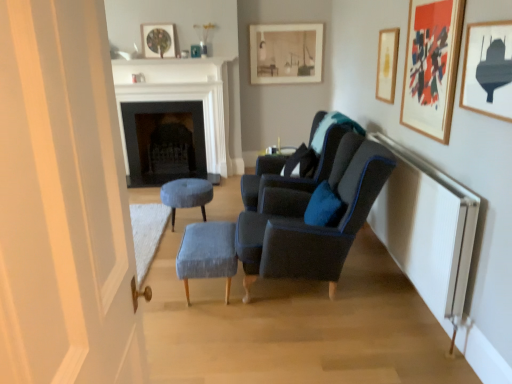
Question: Is dark gray stone fireplace at center, the 2th fireplace from the front, closer to the viewer compared to velvet grey stool at center, arranged as the second stool when viewed from the front?

Choices:
 (A) no
 (B) yes

Answer: (A)

Question: From a real-world perspective, is dark gray stone fireplace at center, the 2th fireplace from the front, physically above velvet grey stool at center, arranged as the first stool when viewed from the back?

Choices:
 (A) no
 (B) yes

Answer: (B)

Question: From the image's perspective, would you say dark gray stone fireplace at center, the 2th fireplace from the front, is positioned over velvet grey stool at center, arranged as the second stool when viewed from the front?

Choices:
 (A) no
 (B) yes

Answer: (B)

Question: Is dark gray stone fireplace at center, the 2th fireplace from the front, thinner than velvet grey stool at center, arranged as the first stool when viewed from the back?

Choices:
 (A) yes
 (B) no

Answer: (A)

Question: Considering the relative positions of dark gray stone fireplace at center, which appears as the 1th fireplace when viewed from the back, and velvet grey stool at center, arranged as the first stool when viewed from the back, in the image provided, is dark gray stone fireplace at center, which appears as the 1th fireplace when viewed from the back, to the left of velvet grey stool at center, arranged as the first stool when viewed from the back, from the viewer's perspective?

Choices:
 (A) no
 (B) yes

Answer: (B)

Question: From the image's perspective, is dark gray stone fireplace at center, which appears as the 1th fireplace when viewed from the back, above or below velvet dark blue armchair at center, the 2th chair in the back-to-front sequence?

Choices:
 (A) below
 (B) above

Answer: (B)

Question: Does point (174, 175) appear closer or farther from the camera than point (268, 259)?

Choices:
 (A) farther
 (B) closer

Answer: (A)

Question: From a real-world perspective, is dark gray stone fireplace at center, the 2th fireplace from the front, above or below velvet dark blue armchair at center, arranged as the 1th chair when viewed from the front?

Choices:
 (A) above
 (B) below

Answer: (B)

Question: Relative to velvet dark blue armchair at center, the 2th chair in the back-to-front sequence, is dark gray stone fireplace at center, the 2th fireplace from the front, in front or behind?

Choices:
 (A) behind
 (B) front

Answer: (A)

Question: From the image's perspective, is gold metallic picture frame at upper right, the 3th picture frame positioned from the back, above or below white textured radiator at right?

Choices:
 (A) below
 (B) above

Answer: (B)

Question: From a real-world perspective, is gold metallic picture frame at upper right, the 3th picture frame positioned from the back, physically located above or below white textured radiator at right?

Choices:
 (A) below
 (B) above

Answer: (B)

Question: Looking at their shapes, would you say gold metallic picture frame at upper right, the 3th picture frame when ordered from left to right, is wider or thinner than white textured radiator at right?

Choices:
 (A) wide
 (B) thin

Answer: (B)

Question: Considering the positions of point (377, 61) and point (471, 205), is point (377, 61) closer or farther from the camera than point (471, 205)?

Choices:
 (A) closer
 (B) farther

Answer: (B)

Question: Relative to matte gold picture frame at upper right, which is the 2th picture frame in front-to-back order, is white marble fireplace at center, the 2th fireplace in the back-to-front sequence, in front or behind?

Choices:
 (A) front
 (B) behind

Answer: (B)

Question: Considering the positions of point (221, 120) and point (440, 21), is point (221, 120) closer or farther from the camera than point (440, 21)?

Choices:
 (A) closer
 (B) farther

Answer: (B)